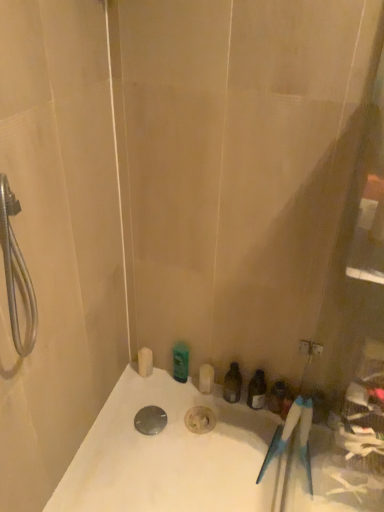
Question: Is white matte soap dispenser at lower left, the 1th toiletry from the left, wider than white glossy bathtub at lower center?

Choices:
 (A) yes
 (B) no

Answer: (B)

Question: Is white matte soap dispenser at lower left, arranged as the 4th toiletry when viewed from the right, taller than white glossy bathtub at lower center?

Choices:
 (A) yes
 (B) no

Answer: (A)

Question: Is white matte soap dispenser at lower left, arranged as the 4th toiletry when viewed from the right, looking in the opposite direction of white glossy bathtub at lower center?

Choices:
 (A) no
 (B) yes

Answer: (A)

Question: Is white matte soap dispenser at lower left, arranged as the 4th toiletry when viewed from the right, not inside white glossy bathtub at lower center?

Choices:
 (A) no
 (B) yes

Answer: (B)

Question: Could you tell me if white matte soap dispenser at lower left, arranged as the 4th toiletry when viewed from the right, is turned towards white glossy bathtub at lower center?

Choices:
 (A) yes
 (B) no

Answer: (B)

Question: Can you confirm if white matte soap dispenser at lower left, arranged as the 4th toiletry when viewed from the right, is positioned to the right of white glossy bathtub at lower center?

Choices:
 (A) yes
 (B) no

Answer: (B)

Question: Does translucent plastic bottle at center, acting as the 3th toiletry starting from the left, have a smaller size compared to green matte bottle at upper center, the second toiletry in the left-to-right sequence?

Choices:
 (A) yes
 (B) no

Answer: (B)

Question: Is translucent plastic bottle at center, which is the second toiletry in right-to-left order, located outside green matte bottle at upper center, arranged as the 3th toiletry when viewed from the right?

Choices:
 (A) no
 (B) yes

Answer: (B)

Question: Is the depth of translucent plastic bottle at center, acting as the 3th toiletry starting from the left, greater than that of green matte bottle at upper center, arranged as the 3th toiletry when viewed from the right?

Choices:
 (A) yes
 (B) no

Answer: (B)

Question: From the image's perspective, is translucent plastic bottle at center, which is the second toiletry in right-to-left order, below green matte bottle at upper center, arranged as the 3th toiletry when viewed from the right?

Choices:
 (A) yes
 (B) no

Answer: (A)

Question: Considering the relative sizes of translucent plastic bottle at center, which is the second toiletry in right-to-left order, and green matte bottle at upper center, arranged as the 3th toiletry when viewed from the right, in the image provided, is translucent plastic bottle at center, which is the second toiletry in right-to-left order, thinner than green matte bottle at upper center, arranged as the 3th toiletry when viewed from the right,?

Choices:
 (A) no
 (B) yes

Answer: (A)

Question: Is translucent plastic bottle at center, acting as the 3th toiletry starting from the left, taller than green matte bottle at upper center, the second toiletry in the left-to-right sequence?

Choices:
 (A) yes
 (B) no

Answer: (A)

Question: From the image's perspective, does matte plastic toiletries at lower right, the fourth toiletry positioned from the left, appear lower than white glossy bathtub at lower center?

Choices:
 (A) no
 (B) yes

Answer: (A)